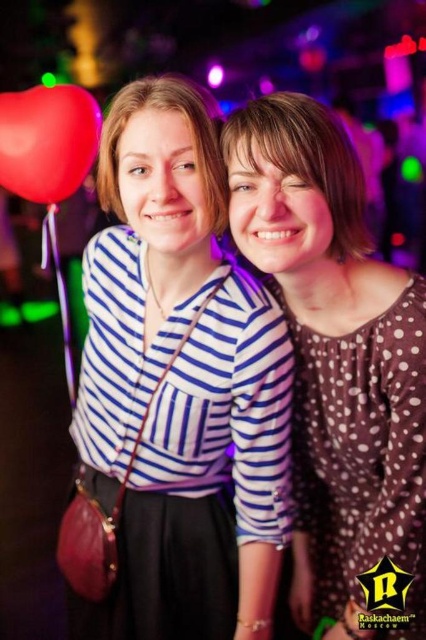
Question: Which object is positioned closest to the rubber heart at left?

Choices:
 (A) brown polka dot blouse at center
 (B) brown dotted dress at center
 (C) matte striped shirt at center

Answer: (C)

Question: Does blue striped shirt at center appear on the left side of rubber heart at left?

Choices:
 (A) yes
 (B) no

Answer: (B)

Question: Which point appears closest to the camera in this image?

Choices:
 (A) 146,77
 (B) 267,440

Answer: (B)

Question: Is blue striped shirt at center to the left of matte striped shirt at center from the viewer's perspective?

Choices:
 (A) no
 (B) yes

Answer: (A)

Question: In this image, where is brown dotted dress at center located relative to matte striped shirt at center?

Choices:
 (A) above
 (B) below

Answer: (B)

Question: Considering the real-world distances, which object is closest to the brown polka dot blouse at center?

Choices:
 (A) brown dotted dress at center
 (B) blue striped shirt at center
 (C) rubber heart at left

Answer: (A)